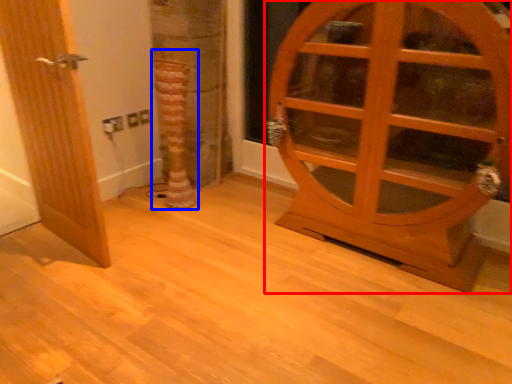
Question: Which point is closer to the camera, door (highlighted by a red box) or tree trunk (highlighted by a blue box)?

Choices:
 (A) door
 (B) tree trunk

Answer: (A)